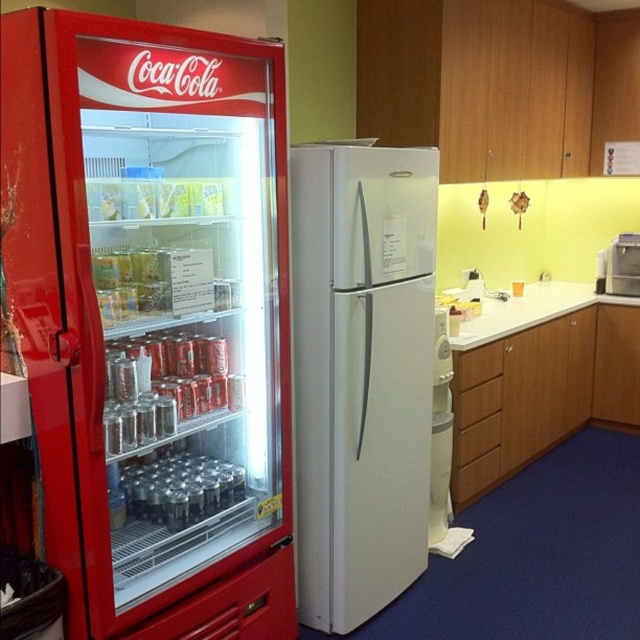
Consider the image. Measure the distance from white matte refrigerator at center to white laminate countertop at center.

white matte refrigerator at center is 3.95 feet away from white laminate countertop at center.

Is white matte refrigerator at center to the left of white laminate countertop at center from the viewer's perspective?

Yes, white matte refrigerator at center is to the left of white laminate countertop at center.

Who is more forward, (323,442) or (605,296)?

Point (323,442)

Locate an element on the screen. white matte refrigerator at center is located at coordinates pos(362,372).

Image resolution: width=640 pixels, height=640 pixels. What do you see at coordinates (529, 310) in the screenshot?
I see `white laminate countertop at center` at bounding box center [529, 310].

This screenshot has width=640, height=640. Find the location of `white laminate countertop at center`. white laminate countertop at center is located at coordinates (x=529, y=310).

Is point (572, 301) more distant than point (611, 243)?

No, it is in front of (611, 243).

This screenshot has width=640, height=640. I want to click on white laminate countertop at center, so click(x=529, y=310).

Which is in front, point (64, 513) or point (416, 384)?

Point (64, 513)

In the scene shown: Can you confirm if metallic red vending machine at left is thinner than white matte refrigerator at center?

No.

Who is more forward, [268,204] or [372,321]?

Point [268,204] is more forward.

Identify the location of metallic red vending machine at left. (154, 317).